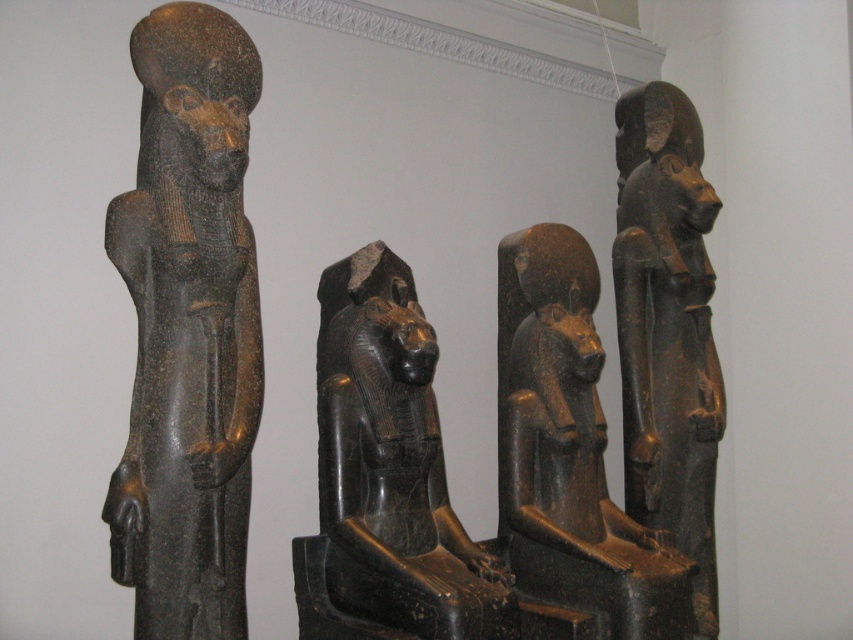
Question: From the image, what is the correct spatial relationship of black polished stone lion at center in relation to black stone statue at right?

Choices:
 (A) right
 (B) left

Answer: (B)

Question: Among these points, which one is farthest from the camera?

Choices:
 (A) (187, 561)
 (B) (701, 186)

Answer: (B)

Question: Does black polished stone lion at center come in front of black stone statue at right?

Choices:
 (A) no
 (B) yes

Answer: (B)

Question: Which of the following is the closest to the observer?

Choices:
 (A) (227, 467)
 (B) (689, 371)
 (C) (367, 618)

Answer: (A)

Question: Is black stone statue at left wider than black stone statue at right?

Choices:
 (A) yes
 (B) no

Answer: (A)

Question: Which point is closer to the camera?

Choices:
 (A) (694, 416)
 (B) (381, 488)

Answer: (B)